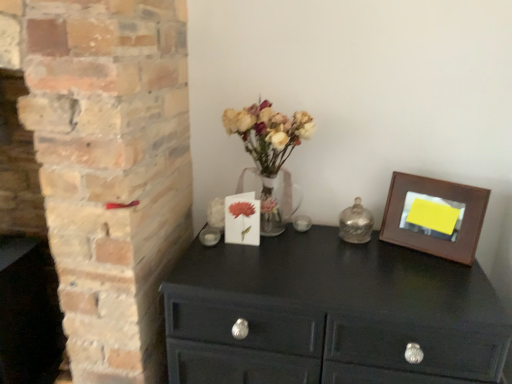
The image size is (512, 384). I want to click on brick fireplace at left, so tap(24, 257).

What do you see at coordinates (434, 217) in the screenshot?
I see `brown wooden picture frame at upper right` at bounding box center [434, 217].

The image size is (512, 384). Identify the location of matte black chest of drawers at center. (329, 313).

Find the location of `shiny metallic bell at center-right`. shiny metallic bell at center-right is located at coordinates (356, 223).

Locate an element on the screen. translucent glass vase at center is located at coordinates (269, 150).

Between point (342, 226) and point (46, 270), which one is positioned in front?

Point (342, 226)

From the image's perspective, which is above, shiny metallic bell at center-right or brick fireplace at left?

shiny metallic bell at center-right, from the image's perspective.

Is shiny metallic bell at center-right oriented towards brick fireplace at left?

No, shiny metallic bell at center-right is not aimed at brick fireplace at left.

How distant is shiny metallic bell at center-right from brick fireplace at left?

shiny metallic bell at center-right is 1.21 meters away from brick fireplace at left.

Is matte black chest of drawers at center facing away from translucent glass vase at center?

No, translucent glass vase at center is not at the back of matte black chest of drawers at center.

In the scene shown: Considering the sizes of objects matte black chest of drawers at center and translucent glass vase at center in the image provided, who is smaller, matte black chest of drawers at center or translucent glass vase at center?

translucent glass vase at center.

Does point (451, 303) appear closer or farther from the camera than point (281, 150)?

Clearly, point (451, 303) is closer to the camera than point (281, 150).

Between matte black chest of drawers at center and translucent glass vase at center, which one appears on the right side from the viewer's perspective?

Positioned to the right is matte black chest of drawers at center.

Which is more distant, [465,227] or [42,309]?

The point [42,309] is more distant.

Which of these two, brown wooden picture frame at upper right or brick fireplace at left, is thinner?

Thinner between the two is brown wooden picture frame at upper right.

From their relative heights in the image, would you say brown wooden picture frame at upper right is taller or shorter than brick fireplace at left?

brown wooden picture frame at upper right is shorter than brick fireplace at left.

From the image's perspective, is brown wooden picture frame at upper right above or below brick fireplace at left?

Based on their image positions, brown wooden picture frame at upper right is located above brick fireplace at left.

What's the angular difference between shiny metallic bell at center-right and translucent glass vase at center's facing directions?

There is a 4.1-degree angle between the facing directions of shiny metallic bell at center-right and translucent glass vase at center.

Is shiny metallic bell at center-right facing away from translucent glass vase at center?

No, shiny metallic bell at center-right is not facing away from translucent glass vase at center.

From the picture: Is shiny metallic bell at center-right wider or thinner than translucent glass vase at center?

Clearly, shiny metallic bell at center-right has less width compared to translucent glass vase at center.

Between shiny metallic bell at center-right and translucent glass vase at center, which one has less height?

With less height is shiny metallic bell at center-right.

From the image's perspective, would you say translucent glass vase at center is shown under matte black chest of drawers at center?

Incorrect, from the image's perspective, translucent glass vase at center is higher than matte black chest of drawers at center.

Between translucent glass vase at center and matte black chest of drawers at center, which one has smaller size?

With smaller size is translucent glass vase at center.

Considering the positions of objects translucent glass vase at center and matte black chest of drawers at center in the image provided, who is more to the right, translucent glass vase at center or matte black chest of drawers at center?

Positioned to the right is matte black chest of drawers at center.

In the scene shown: Which object is wider, translucent glass vase at center or matte black chest of drawers at center?

matte black chest of drawers at center.

Is translucent glass vase at center spatially inside brick fireplace at left, or outside of it?

translucent glass vase at center lies outside brick fireplace at left.

The image size is (512, 384). In order to click on fireplace that appears on the left of translucent glass vase at center in this screenshot , I will do `click(24, 257)`.

Between translucent glass vase at center and brick fireplace at left, which one has smaller size?

translucent glass vase at center.

Considering the relative positions of translucent glass vase at center and brick fireplace at left in the image provided, is translucent glass vase at center to the left or to the right of brick fireplace at left?

translucent glass vase at center is positioned on brick fireplace at left's right side.

Is translucent glass vase at center bigger or smaller than shiny metallic bell at center-right?

In the image, translucent glass vase at center appears to be larger than shiny metallic bell at center-right.

From the image's perspective, between translucent glass vase at center and shiny metallic bell at center-right, which one is located above?

translucent glass vase at center, from the image's perspective.

Considering the sizes of translucent glass vase at center and shiny metallic bell at center-right in the image, is translucent glass vase at center taller or shorter than shiny metallic bell at center-right?

translucent glass vase at center is taller than shiny metallic bell at center-right.

This screenshot has height=384, width=512. I want to click on candle holder above the brick fireplace at left (from a real-world perspective), so click(356, 223).

The image size is (512, 384). In order to click on floral arrangement behind the matte black chest of drawers at center in this screenshot , I will do `click(269, 150)`.

Estimate the real-world distances between objects in this image. Which object is further from shiny metallic bell at center-right, matte black chest of drawers at center or translucent glass vase at center?

The object further to shiny metallic bell at center-right is matte black chest of drawers at center.

Which object lies further to the anchor point translucent glass vase at center, matte black chest of drawers at center or brick fireplace at left?

brick fireplace at left lies further to translucent glass vase at center than the other object.

Estimate the real-world distances between objects in this image. Which object is closer to translucent glass vase at center, brown wooden picture frame at upper right or shiny metallic bell at center-right?

Based on the image, shiny metallic bell at center-right appears to be nearer to translucent glass vase at center.

When comparing their distances from translucent glass vase at center, does shiny metallic bell at center-right or brick fireplace at left seem further?

Among the two, brick fireplace at left is located further to translucent glass vase at center.

Looking at the image, which one is located further to matte black chest of drawers at center, brick fireplace at left or translucent glass vase at center?

The object further to matte black chest of drawers at center is brick fireplace at left.

Looking at the image, which one is located further to brick fireplace at left, matte black chest of drawers at center or brown wooden picture frame at upper right?

The object further to brick fireplace at left is brown wooden picture frame at upper right.

Looking at the image, which one is located closer to matte black chest of drawers at center, brick fireplace at left or shiny metallic bell at center-right?

The object closer to matte black chest of drawers at center is shiny metallic bell at center-right.

When comparing their distances from brick fireplace at left, does translucent glass vase at center or brown wooden picture frame at upper right seem further?

brown wooden picture frame at upper right.

Identify the location of floral arrangement located between brick fireplace at left and matte black chest of drawers at center in the left-right direction. Image resolution: width=512 pixels, height=384 pixels. (269, 150).

Identify the location of candle holder between brick fireplace at left and brown wooden picture frame at upper right in the horizontal direction. This screenshot has height=384, width=512. (356, 223).

Identify the location of candle holder that lies between brown wooden picture frame at upper right and matte black chest of drawers at center from top to bottom. This screenshot has height=384, width=512. (356, 223).

Identify the location of picture frame between translucent glass vase at center and matte black chest of drawers at center in the up-down direction. (434, 217).